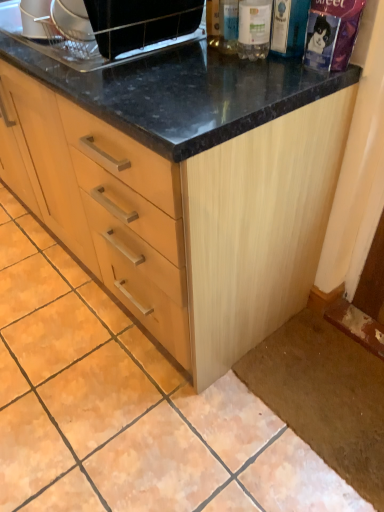
What do you see at coordinates (289, 27) in the screenshot? The height and width of the screenshot is (512, 384). I see `transparent plastic bottle at upper right, acting as the third bottle starting from the left` at bounding box center [289, 27].

At what (x,y) coordinates should I click in order to perform the action: click on black glossy microwave at upper center. Please return your answer as a coordinate pair (x, y). The height and width of the screenshot is (512, 384). Looking at the image, I should click on (140, 22).

The width and height of the screenshot is (384, 512). What do you see at coordinates (185, 186) in the screenshot?
I see `light wood cabinet at center` at bounding box center [185, 186].

Locate an element on the screen. The width and height of the screenshot is (384, 512). transparent plastic bottle at upper right, which is counted as the 1th bottle, starting from the right is located at coordinates (289, 27).

Is light wood cabinet at center thinner than clear plastic bottle at upper right, the second bottle when ordered from left to right?

No, light wood cabinet at center is not thinner than clear plastic bottle at upper right, the second bottle when ordered from left to right.

Where is `cabinetry to the left of clear plastic bottle at upper right, positioned as the second bottle in right-to-left order`? The image size is (384, 512). cabinetry to the left of clear plastic bottle at upper right, positioned as the second bottle in right-to-left order is located at coordinates (185, 186).

Can clear plastic bottle at upper right, the second bottle when ordered from left to right, be found inside light wood cabinet at center?

No, clear plastic bottle at upper right, the second bottle when ordered from left to right, is not a part of light wood cabinet at center.

Which of these two, light wood cabinet at center or clear plastic bottle at upper right, the second bottle when ordered from left to right, is smaller?

clear plastic bottle at upper right, the second bottle when ordered from left to right.

Considering the positions of objects transparent plastic bottle at upper right, which is counted as the 1th bottle, starting from the right, and black glossy microwave at upper center in the image provided, who is in front, transparent plastic bottle at upper right, which is counted as the 1th bottle, starting from the right, or black glossy microwave at upper center?

black glossy microwave at upper center is more forward.

Identify the location of appliance on the left of transparent plastic bottle at upper right, which is counted as the 1th bottle, starting from the right. The height and width of the screenshot is (512, 384). (140, 22).

Which point is more forward, (276,34) or (100,8)?

Point (100,8)

Looking at this image, which is more to the right, transparent plastic bottle at upper right, which is counted as the 1th bottle, starting from the right, or black glossy microwave at upper center?

transparent plastic bottle at upper right, which is counted as the 1th bottle, starting from the right, is more to the right.

From a real-world perspective, is clear plastic bottle at upper right, positioned as the second bottle in right-to-left order, located higher than transparent plastic bottle at upper right, which is counted as the 1th bottle, starting from the right?

Yes.

Consider the image. How many degrees apart are the facing directions of clear plastic bottle at upper right, the second bottle when ordered from left to right, and transparent plastic bottle at upper right, acting as the third bottle starting from the left?

They differ by 0.000371 degrees in their facing directions.

Is clear plastic bottle at upper right, the second bottle when ordered from left to right, beside transparent plastic bottle at upper right, which is counted as the 1th bottle, starting from the right?

Yes, the surface of clear plastic bottle at upper right, the second bottle when ordered from left to right, is in contact with transparent plastic bottle at upper right, which is counted as the 1th bottle, starting from the right.

Consider the image. Is clear plastic bottle at upper right, positioned as the second bottle in right-to-left order, situated inside transparent plastic bottle at upper right, which is counted as the 1th bottle, starting from the right, or outside?

clear plastic bottle at upper right, positioned as the second bottle in right-to-left order, lies outside transparent plastic bottle at upper right, which is counted as the 1th bottle, starting from the right.

Is clear plastic bottle at upper right, positioned as the second bottle in right-to-left order, inside the boundaries of clear glass bottle at upper center, the 1th bottle from the left, or outside?

clear plastic bottle at upper right, positioned as the second bottle in right-to-left order, is located beyond the bounds of clear glass bottle at upper center, the 1th bottle from the left.

Does clear plastic bottle at upper right, the second bottle when ordered from left to right, touch clear glass bottle at upper center, arranged as the 3th bottle when viewed from the right?

Indeed, clear plastic bottle at upper right, the second bottle when ordered from left to right, and clear glass bottle at upper center, arranged as the 3th bottle when viewed from the right, are beside each other and touching.

Between clear plastic bottle at upper right, the second bottle when ordered from left to right, and clear glass bottle at upper center, the 1th bottle from the left, which one has less height?

With less height is clear glass bottle at upper center, the 1th bottle from the left.

From the picture: What's the angular difference between clear glass bottle at upper center, the 1th bottle from the left, and clear plastic bottle at upper right, positioned as the second bottle in right-to-left order,'s facing directions?

0.00206 degrees separate the facing orientations of clear glass bottle at upper center, the 1th bottle from the left, and clear plastic bottle at upper right, positioned as the second bottle in right-to-left order.

Does point (214, 5) lie in front of point (248, 8)?

No, (214, 5) is behind (248, 8).

Looking at this image, could you measure the distance between clear glass bottle at upper center, arranged as the 3th bottle when viewed from the right, and clear plastic bottle at upper right, positioned as the second bottle in right-to-left order?

clear glass bottle at upper center, arranged as the 3th bottle when viewed from the right, is 5.47 centimeters from clear plastic bottle at upper right, positioned as the second bottle in right-to-left order.

Is clear glass bottle at upper center, the 1th bottle from the left, positioned beyond the bounds of clear plastic bottle at upper right, the second bottle when ordered from left to right?

clear glass bottle at upper center, the 1th bottle from the left, lies outside clear plastic bottle at upper right, the second bottle when ordered from left to right,'s area.

Between point (247, 44) and point (31, 186), which one is positioned behind?

The point (31, 186) is farther.

Starting from the light wood cabinet at center, which bottle is the 1st one behind? Please provide its 2D coordinates.

[(254, 29)]

Between clear plastic bottle at upper right, positioned as the second bottle in right-to-left order, and light wood cabinet at center, which one appears on the right side from the viewer's perspective?

Positioned to the right is clear plastic bottle at upper right, positioned as the second bottle in right-to-left order.

Considering the positions of objects clear plastic bottle at upper right, the second bottle when ordered from left to right, and light wood cabinet at center in the image provided, who is behind, clear plastic bottle at upper right, the second bottle when ordered from left to right, or light wood cabinet at center?

clear plastic bottle at upper right, the second bottle when ordered from left to right, is more distant.

Is black glossy microwave at upper center to the left or to the right of transparent plastic bottle at upper right, acting as the third bottle starting from the left, in the image?

In the image, black glossy microwave at upper center appears on the left side of transparent plastic bottle at upper right, acting as the third bottle starting from the left.

Can you tell me how much black glossy microwave at upper center and transparent plastic bottle at upper right, acting as the third bottle starting from the left, differ in facing direction?

They differ by 2.72 degrees in their facing directions.

Does point (92, 5) come behind point (301, 24)?

That is False.

Where is `cabinetry that is on the left side of clear plastic bottle at upper right, the second bottle when ordered from left to right`? Image resolution: width=384 pixels, height=512 pixels. cabinetry that is on the left side of clear plastic bottle at upper right, the second bottle when ordered from left to right is located at coordinates (185, 186).

In the image, there is a transparent plastic bottle at upper right, which is counted as the 1th bottle, starting from the right. Where is `appliance above it (from the image's perspective)`? appliance above it (from the image's perspective) is located at coordinates (140, 22).

When comparing their distances from black glossy microwave at upper center, does transparent plastic bottle at upper right, which is counted as the 1th bottle, starting from the right, or clear plastic bottle at upper right, positioned as the second bottle in right-to-left order, seem closer?

clear plastic bottle at upper right, positioned as the second bottle in right-to-left order, is closer to black glossy microwave at upper center.

Considering their positions, is clear plastic bottle at upper right, positioned as the second bottle in right-to-left order, positioned closer to black glossy microwave at upper center than transparent plastic bottle at upper right, which is counted as the 1th bottle, starting from the right?

Based on the image, clear plastic bottle at upper right, positioned as the second bottle in right-to-left order, appears to be nearer to black glossy microwave at upper center.

Based on their spatial positions, is black glossy microwave at upper center or light wood cabinet at center closer to clear plastic bottle at upper right, positioned as the second bottle in right-to-left order?

black glossy microwave at upper center is closer to clear plastic bottle at upper right, positioned as the second bottle in right-to-left order.

When comparing their distances from black glossy microwave at upper center, does light wood cabinet at center or clear plastic bottle at upper right, the second bottle when ordered from left to right, seem closer?

clear plastic bottle at upper right, the second bottle when ordered from left to right, lies closer to black glossy microwave at upper center than the other object.

Estimate the real-world distances between objects in this image. Which object is further from transparent plastic bottle at upper right, acting as the third bottle starting from the left, clear glass bottle at upper center, the 1th bottle from the left, or light wood cabinet at center?

light wood cabinet at center.

Estimate the real-world distances between objects in this image. Which object is further from transparent plastic bottle at upper right, which is counted as the 1th bottle, starting from the right, light wood cabinet at center or black glossy microwave at upper center?

Among the two, light wood cabinet at center is located further to transparent plastic bottle at upper right, which is counted as the 1th bottle, starting from the right.

In the scene shown: From the image, which object appears to be farther from clear plastic bottle at upper right, positioned as the second bottle in right-to-left order, light wood cabinet at center or black glossy microwave at upper center?

light wood cabinet at center is positioned further to the anchor clear plastic bottle at upper right, positioned as the second bottle in right-to-left order.

Looking at the image, which one is located further to clear glass bottle at upper center, the 1th bottle from the left, clear plastic bottle at upper right, the second bottle when ordered from left to right, or transparent plastic bottle at upper right, which is counted as the 1th bottle, starting from the right?

transparent plastic bottle at upper right, which is counted as the 1th bottle, starting from the right, is further to clear glass bottle at upper center, the 1th bottle from the left.

Find the location of a particular element. This screenshot has width=384, height=512. bottle between clear glass bottle at upper center, the 1th bottle from the left, and transparent plastic bottle at upper right, acting as the third bottle starting from the left is located at coordinates (254, 29).

The height and width of the screenshot is (512, 384). What are the coordinates of `appliance between light wood cabinet at center and transparent plastic bottle at upper right, acting as the third bottle starting from the left, in the horizontal direction` in the screenshot? It's located at (140, 22).

At what (x,y) coordinates should I click in order to perform the action: click on bottle situated between black glossy microwave at upper center and clear plastic bottle at upper right, the second bottle when ordered from left to right, from left to right. Please return your answer as a coordinate pair (x, y). The image size is (384, 512). Looking at the image, I should click on (222, 25).

You are a GUI agent. You are given a task and a screenshot of the screen. Output one action in this format:
    pyautogui.click(x=<x>, y=<y>)
    Task: Click on the bottle between light wood cabinet at center and clear plastic bottle at upper right, the second bottle when ordered from left to right, in the horizontal direction
    This screenshot has width=384, height=512.
    Given the screenshot: What is the action you would take?
    pyautogui.click(x=222, y=25)